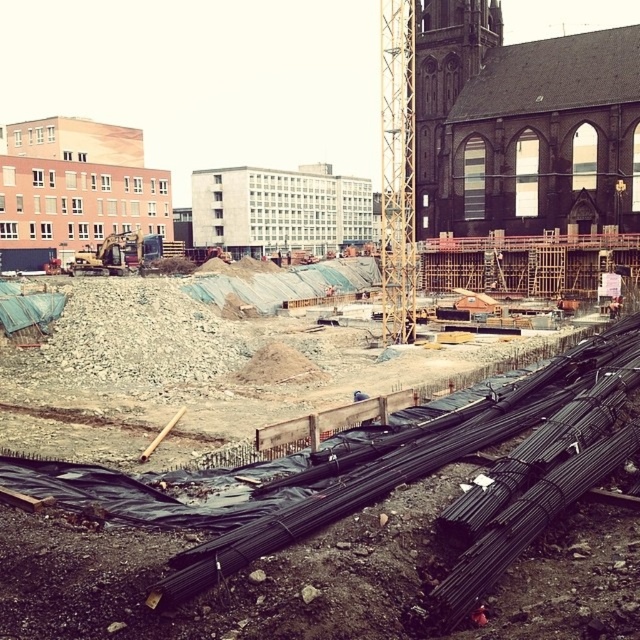
Who is taller, black metal rebar at lower center or dark brown stone church at upper right?

dark brown stone church at upper right is taller.

Does black metal rebar at lower center appear over dark brown stone church at upper right?

Incorrect, black metal rebar at lower center is not positioned above dark brown stone church at upper right.

Measure the distance between black metal rebar at lower center and camera.

The distance of black metal rebar at lower center from camera is 24.33 meters.

This screenshot has height=640, width=640. In order to click on black metal rebar at lower center in this screenshot , I will do `click(228, 579)`.

Can you confirm if brick building at upper left is smaller than yellow metallic excavator at left?

No, brick building at upper left is not smaller than yellow metallic excavator at left.

Which is behind, point (129, 141) or point (138, 244)?

Positioned behind is point (129, 141).

Which is in front, point (106, 141) or point (115, 234)?

Point (115, 234)

Where is `brick building at upper left`? The height and width of the screenshot is (640, 640). brick building at upper left is located at coordinates (74, 188).

Does dark brown stone church at upper right appear over wooden scaffolding at upper center?

Incorrect, dark brown stone church at upper right is not positioned above wooden scaffolding at upper center.

Between point (595, 284) and point (403, 188), which one is positioned in front?

Point (403, 188) is more forward.

I want to click on dark brown stone church at upper right, so click(x=524, y=154).